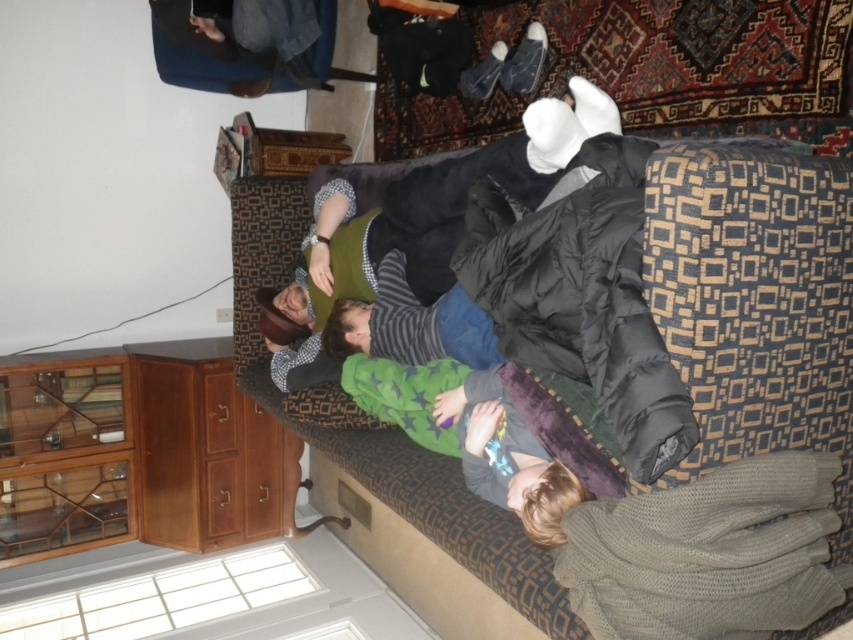
You are trying to decide whether to use the green knitted sleeping bag at lower right or the green fuzzy blanket at center to cover yourself. Which one is closer to your current position on the sofa?

The green fuzzy blanket at center is closer to your current position on the sofa because it is placed above the green knitted sleeping bag at lower right, which is underneath it.

You are standing in the room and want to cover the person on the right with the green fuzzy blanket at center. Based on their positions, can you reach the blanket without moving the sofa?

The green fuzzy blanket at center is located at point [469,435], which is within reach of the person on the right without needing to move the sofa.

You are a delivery person holding a package that requires a minimum of 1.5 meters of space to place. You see the dark brown fabric couch at center. Is there enough space in front of the couch to place the package?

The distance between the dark brown fabric couch at center and the viewer is 1.25 meters, which is less than the required 1.5 meters. Therefore, there isn not enough space to place the package.